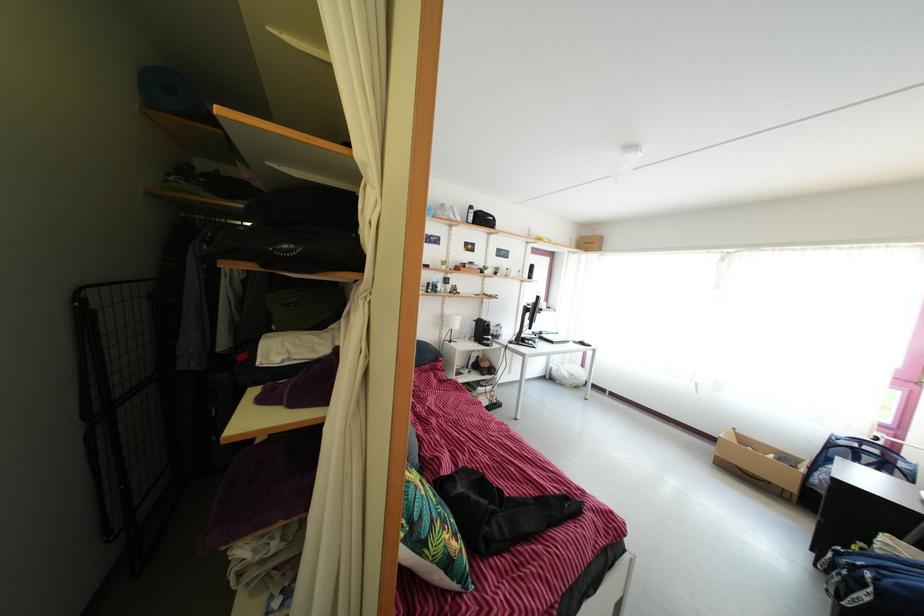
The image size is (924, 616). What are the coordinates of `small plant pot` in the screenshot? It's located at (444, 262).